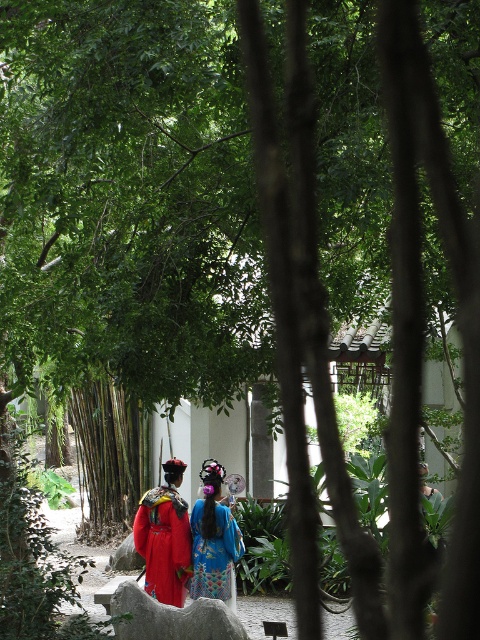
Is the position of green bamboo forest at center less distant than that of blue silk dress at center?

That is False.

Does green bamboo forest at center have a larger size compared to blue silk dress at center?

Incorrect, green bamboo forest at center is not larger than blue silk dress at center.

Is point (82, 458) positioned after point (222, 552)?

Yes, point (82, 458) is behind point (222, 552).

Locate an element on the screen. This screenshot has width=480, height=640. green bamboo forest at center is located at coordinates (109, 456).

Does point (94, 410) come closer to viewer compared to point (175, 500)?

That is False.

Between green bamboo forest at center and red satin robe at center, which one has less height?

green bamboo forest at center is shorter.

The image size is (480, 640). What do you see at coordinates (109, 456) in the screenshot?
I see `green bamboo forest at center` at bounding box center [109, 456].

At what (x,y) coordinates should I click in order to perform the action: click on green bamboo forest at center. Please return your answer as a coordinate pair (x, y). Image resolution: width=480 pixels, height=640 pixels. Looking at the image, I should click on (109, 456).

Between point (144, 500) and point (196, 589), which one is positioned in front?

Positioned in front is point (196, 589).

Consider the image. Does red satin robe at center have a lesser height compared to blue silk dress at center?

Yes, red satin robe at center is shorter than blue silk dress at center.

Between point (148, 572) and point (192, 516), which one is positioned behind?

The point (148, 572) is behind.

What are the coordinates of `red satin robe at center` in the screenshot? It's located at (164, 544).